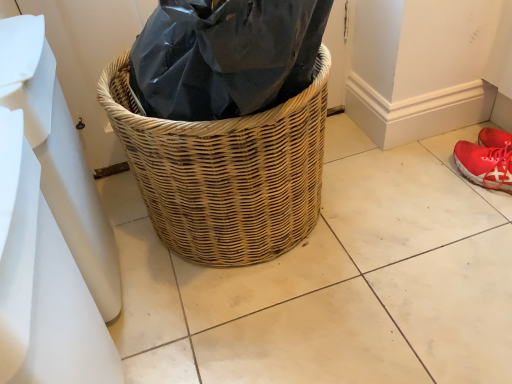
This screenshot has height=384, width=512. Find the location of `woven natural basket at center`. woven natural basket at center is located at coordinates (225, 172).

The width and height of the screenshot is (512, 384). What do you see at coordinates (225, 172) in the screenshot?
I see `woven natural basket at center` at bounding box center [225, 172].

Locate an element on the screen. This screenshot has width=512, height=384. woven natural basket at center is located at coordinates (225, 172).